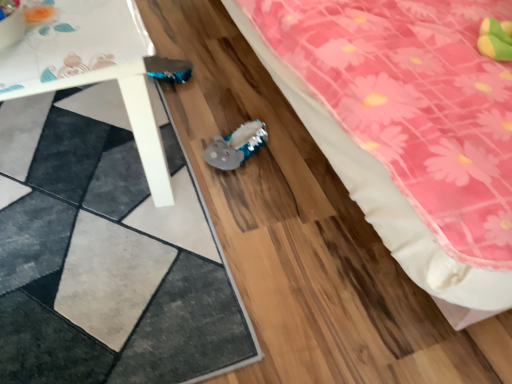
You are a GUI agent. You are given a task and a screenshot of the screen. Output one action in this format:
    pyautogui.click(x=<x>, y=<y>)
    Task: Click on the spots to the right of fuzzy fabric plushie at center
    Image resolution: width=512 pixels, height=384 pixels.
    Given the screenshot: What is the action you would take?
    [293, 156]